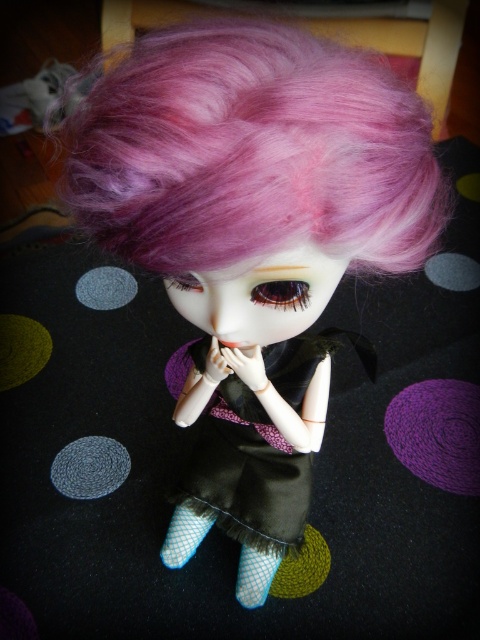
You are a stylist preparing to style the doll for a photoshoot. You need to ensure that the pink fluffy wig at center and the brown glossy eye at center are visible in the final shot. Given their sizes, which object will require more space horizontally in the frame?

The pink fluffy wig at center requires more horizontal space because its width surpasses that of the brown glossy eye at center.

You are holding a camera and want to take a closeup shot of the doll. The camera is currently positioned such that the point at coordinates point (204, 444) is 38.98 inches away. To get a closer shot, how much closer should you move the camera to the doll?

To get a closer shot, you should move the camera 38.98 inches closer to the doll so that the point at coordinates point (204, 444) is now at the desired distance for the closeup.